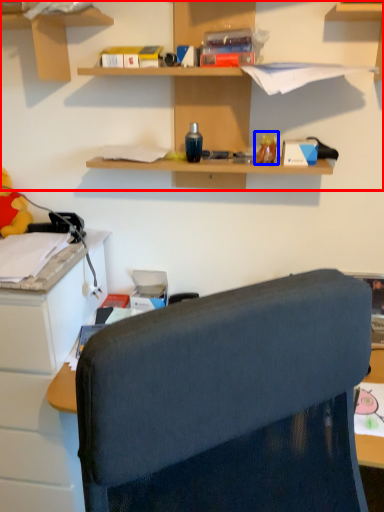
Question: Which object appears farthest to the camera in this image, shelf (highlighted by a red box) or toy (highlighted by a blue box)?

Choices:
 (A) shelf
 (B) toy

Answer: (B)